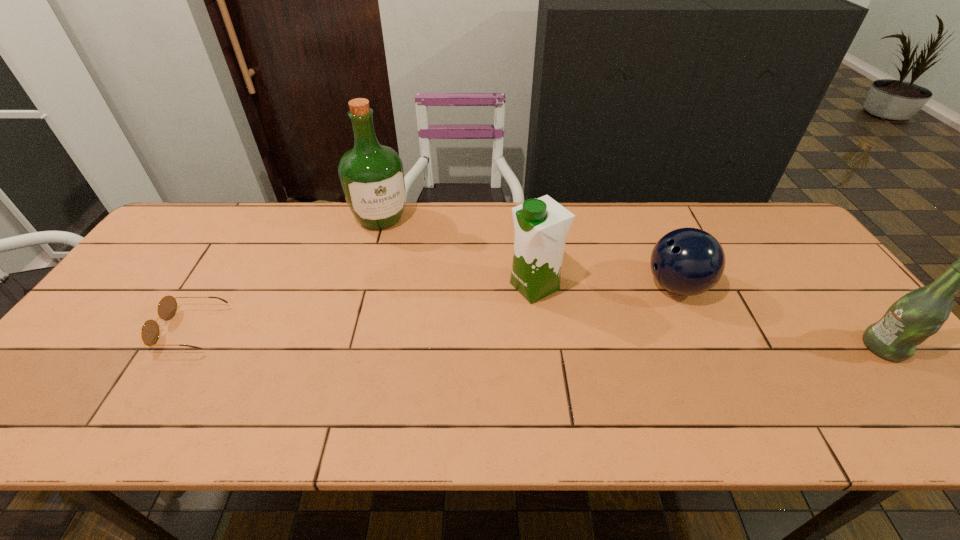
This screenshot has width=960, height=540. Identify the location of object at the near edge. (919, 314).

Where is `object situated at the right edge`? object situated at the right edge is located at coordinates (919, 314).

This screenshot has width=960, height=540. Identify the location of object that is at the near right corner. (919, 314).

Locate an element on the screen. The image size is (960, 540). blank area at the far edge is located at coordinates (604, 232).

At what (x,y) coordinates should I click in order to perform the action: click on free space at the near edge of the desktop. Please return your answer as a coordinate pair (x, y). The width and height of the screenshot is (960, 540). Looking at the image, I should click on (277, 383).

At what (x,y) coordinates should I click in order to perform the action: click on free space at the right edge. Please return your answer as a coordinate pair (x, y). The height and width of the screenshot is (540, 960). Looking at the image, I should click on (795, 252).

Find the location of a particular element. Image resolution: width=960 pixels, height=540 pixels. blank space at the near left corner is located at coordinates (85, 375).

This screenshot has height=540, width=960. In the image, there is a desktop. What are the coordinates of `vacant space at the far right corner` in the screenshot? It's located at (776, 221).

In the image, there is a desktop. Where is `vacant space at the near right corner`? vacant space at the near right corner is located at coordinates (873, 382).

The width and height of the screenshot is (960, 540). I want to click on unoccupied area between the farthest object and the shortest object, so click(x=286, y=274).